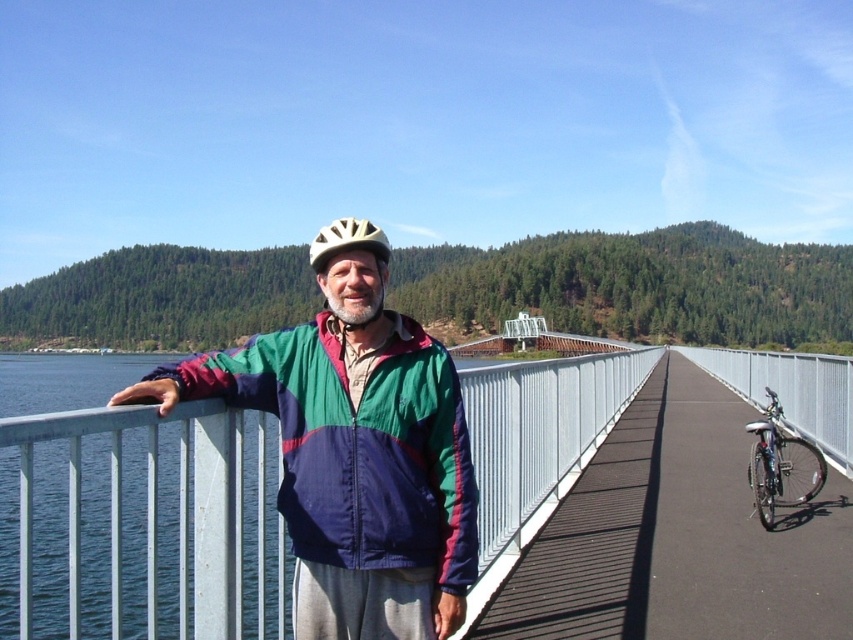
Question: Is multicolored fabric jacket at center behind silver metallic bicycle at right?

Choices:
 (A) no
 (B) yes

Answer: (A)

Question: Considering the relative positions of multicolored fabric jacket at center and silver metallic bicycle at right in the image provided, where is multicolored fabric jacket at center located with respect to silver metallic bicycle at right?

Choices:
 (A) left
 (B) right

Answer: (A)

Question: Which object is positioned closest to the multicolored fabric jacket at center?

Choices:
 (A) matte yellow helmet at center
 (B) silver metallic bicycle at right

Answer: (A)

Question: In this image, where is multicolored fabric jacket at center located relative to silver metallic bicycle at right?

Choices:
 (A) above
 (B) below

Answer: (A)

Question: Among these objects, which one is nearest to the camera?

Choices:
 (A) multicolored fabric jacket at center
 (B) matte yellow helmet at center

Answer: (A)

Question: Among these points, which one is farthest from the camera?

Choices:
 (A) (750, 476)
 (B) (361, 225)

Answer: (A)